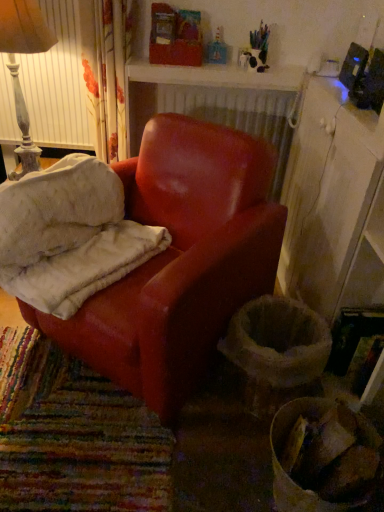
Question: Is white textured radiator at upper center with white wood cabinet at right?

Choices:
 (A) yes
 (B) no

Answer: (B)

Question: From a real-world perspective, does white textured radiator at upper center sit lower than white wood cabinet at right?

Choices:
 (A) no
 (B) yes

Answer: (A)

Question: Can you confirm if white textured radiator at upper center is positioned to the left of white wood cabinet at right?

Choices:
 (A) yes
 (B) no

Answer: (A)

Question: Could you tell me if white textured radiator at upper center is facing white wood cabinet at right?

Choices:
 (A) no
 (B) yes

Answer: (B)

Question: From a real-world perspective, is white textured radiator at upper center over white wood cabinet at right?

Choices:
 (A) no
 (B) yes

Answer: (B)

Question: Considering the relative sizes of white textured radiator at upper center and white wood cabinet at right in the image provided, is white textured radiator at upper center taller than white wood cabinet at right?

Choices:
 (A) no
 (B) yes

Answer: (A)

Question: Is matte red armchair at center facing towards white wood cabinet at right?

Choices:
 (A) yes
 (B) no

Answer: (B)

Question: Considering the relative positions of matte red armchair at center and white wood cabinet at right in the image provided, is matte red armchair at center behind white wood cabinet at right?

Choices:
 (A) yes
 (B) no

Answer: (B)

Question: Is white wood cabinet at right inside matte red armchair at center?

Choices:
 (A) yes
 (B) no

Answer: (B)

Question: From the image's perspective, is matte red armchair at center above white wood cabinet at right?

Choices:
 (A) yes
 (B) no

Answer: (B)

Question: Is matte red armchair at center shorter than white wood cabinet at right?

Choices:
 (A) no
 (B) yes

Answer: (B)

Question: Is matte red armchair at center to the right of white wood cabinet at right from the viewer's perspective?

Choices:
 (A) yes
 (B) no

Answer: (B)

Question: Is leather armchair at center surrounding distressed white lampshade at upper left?

Choices:
 (A) yes
 (B) no

Answer: (B)